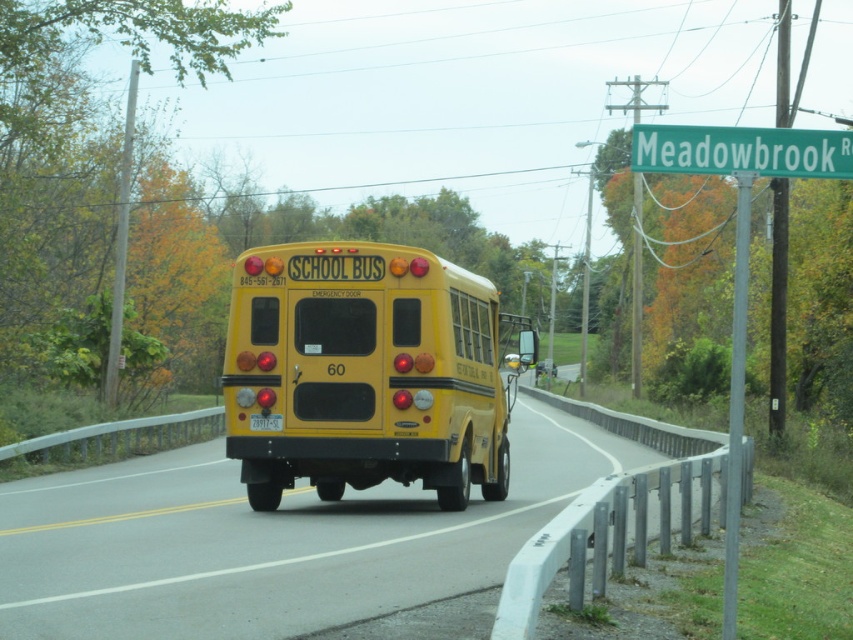
Question: Which point is farther to the camera?

Choices:
 (A) yellow matte school bus at center
 (B) green plastic street sign at upper center
 (C) green plastic signpost at upper right
 (D) yellow matte/solid school bus at center

Answer: (C)

Question: Considering the relative positions of yellow matte/solid school bus at center and green plastic signpost at upper right in the image provided, where is yellow matte/solid school bus at center located with respect to green plastic signpost at upper right?

Choices:
 (A) above
 (B) below

Answer: (B)

Question: Which object appears farthest from the camera in this image?

Choices:
 (A) green plastic street sign at upper center
 (B) green plastic signpost at upper right
 (C) gray metallic pole at right
 (D) yellow matte school bus at center

Answer: (B)

Question: Which of the following is the closest to the observer?

Choices:
 (A) (730, 532)
 (B) (445, 509)

Answer: (A)

Question: From the image, what is the correct spatial relationship of yellow matte/solid school bus at center in relation to green plastic street sign at upper center?

Choices:
 (A) above
 (B) below

Answer: (B)

Question: Does yellow matte/solid school bus at center have a smaller size compared to gray metallic pole at right?

Choices:
 (A) yes
 (B) no

Answer: (A)